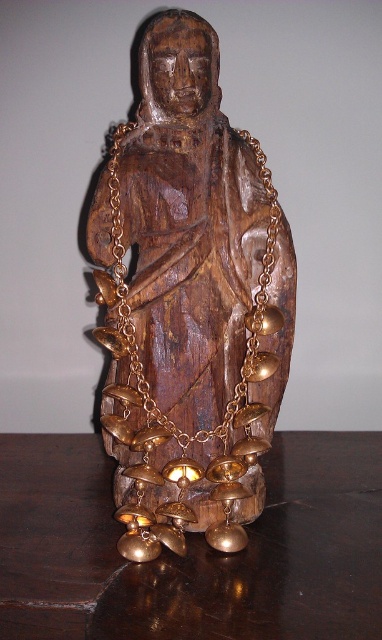
You are an art curator planning to move the wooden statue at center to a new location. You need to ensure that the shiny dark wood table at center is visible from the front entrance. Should you move the statue forward or backward to achieve this?

The shiny dark wood table at center is behind the wooden statue at center. To make the table visible from the front entrance, you should move the wooden statue at center backward so that the table in front of it becomes visible.

You are an art curator arranging a gallery exhibit. You have a wooden statue at center and a shiny dark wood table at center. Where should you place the statue relative to the table to maintain the exhibit layout?

The wooden statue at center should be placed on the left side of the shiny dark wood table at center as described in the objects description.